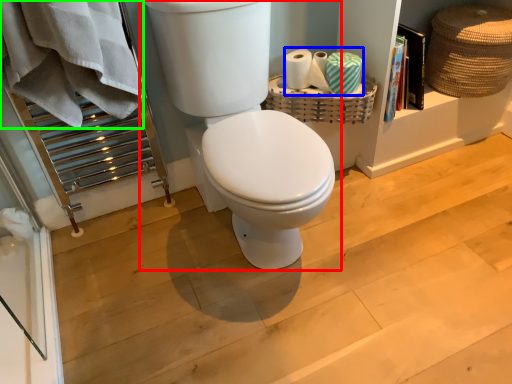
Question: Which object is positioned closest to toilet (highlighted by a red box)? Select from toilet paper (highlighted by a blue box) and bath towel (highlighted by a green box).

Choices:
 (A) toilet paper
 (B) bath towel

Answer: (B)